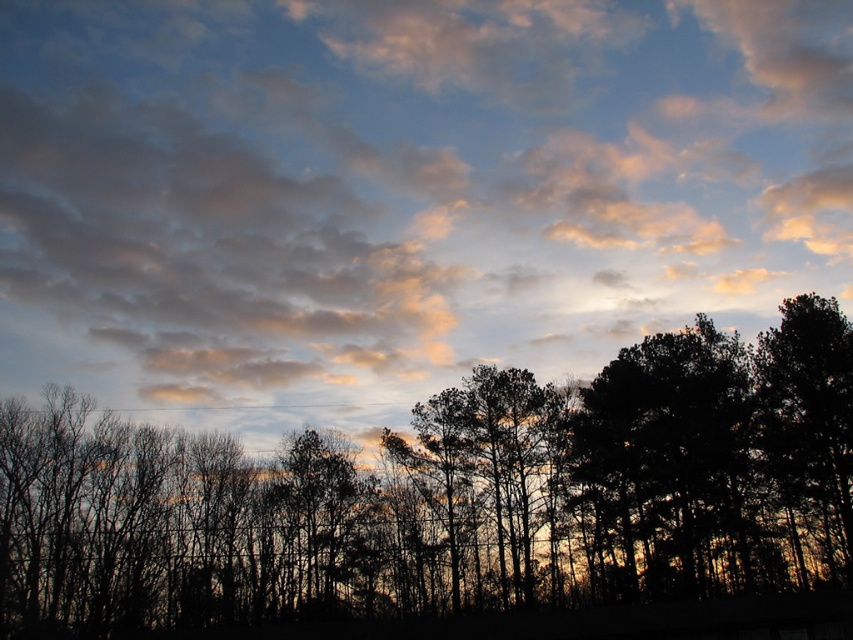
Is cloudy sky at upper center to the left of dark green leafy tree at right from the viewer's perspective?

Correct, you'll find cloudy sky at upper center to the left of dark green leafy tree at right.

Which is in front, point (36, 148) or point (795, 548)?

Point (795, 548)

Is point (683, 3) less distant than point (792, 358)?

No, (683, 3) is further to viewer.

The height and width of the screenshot is (640, 853). Identify the location of cloudy sky at upper center. (402, 193).

Which is more to the right, silhouette trees at lower center or dark green leafy tree at right?

From the viewer's perspective, dark green leafy tree at right appears more on the right side.

Looking at this image, is silhouette trees at lower center further to the viewer compared to dark green leafy tree at right?

No, it is not.

Which is behind, point (245, 547) or point (850, 449)?

The point (850, 449) is behind.

Where is `silhouette trees at lower center`? silhouette trees at lower center is located at coordinates (450, 496).

Which is behind, point (793, 148) or point (677, 538)?

Positioned behind is point (793, 148).

Is cloudy sky at upper center to the right of silhouette trees at lower center from the viewer's perspective?

Incorrect, cloudy sky at upper center is not on the right side of silhouette trees at lower center.

Looking at this image, who is more forward, (155, 218) or (274, 509)?

Positioned in front is point (274, 509).

Find the location of a particular element. The image size is (853, 640). cloudy sky at upper center is located at coordinates (402, 193).